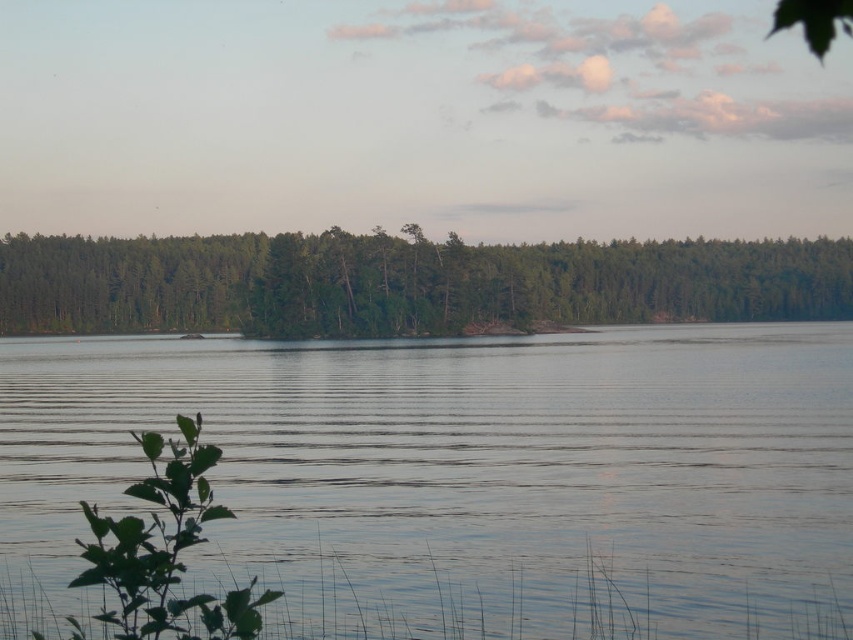
Is clear water at center further to camera compared to green matte forest at center?

No, clear water at center is in front of green matte forest at center.

Can you confirm if clear water at center is positioned below green matte forest at center?

Indeed, clear water at center is positioned under green matte forest at center.

Identify the location of clear water at center. [x=467, y=474].